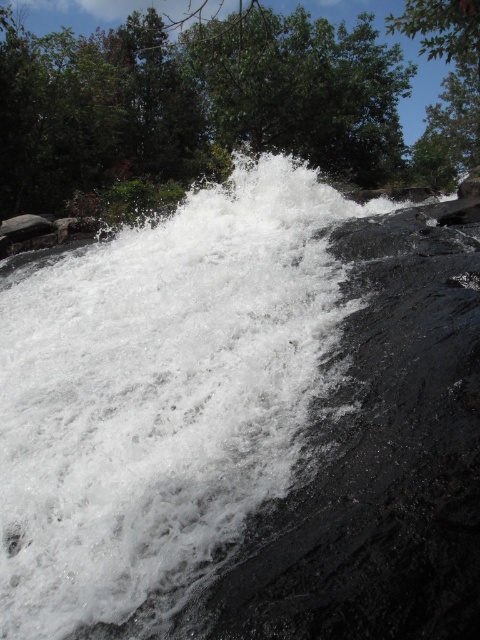
Based on the photo, you are standing at the edge of the waterfall and see the point marked at coordinates point (160,397). What is located at that point?

The point (160,397) corresponds to white frothy water at center.

You are a photographer planning to capture the waterfall and the tree in the scene. Since the white frothy water at center and the green leafy tree at upper center are both important, which one should you focus on first if you want to ensure both are in the frame?

You should focus on the green leafy tree at upper center first because it is positioned above the white frothy water at center, so adjusting the frame to include the upper part ensures the lower subject is already within view.